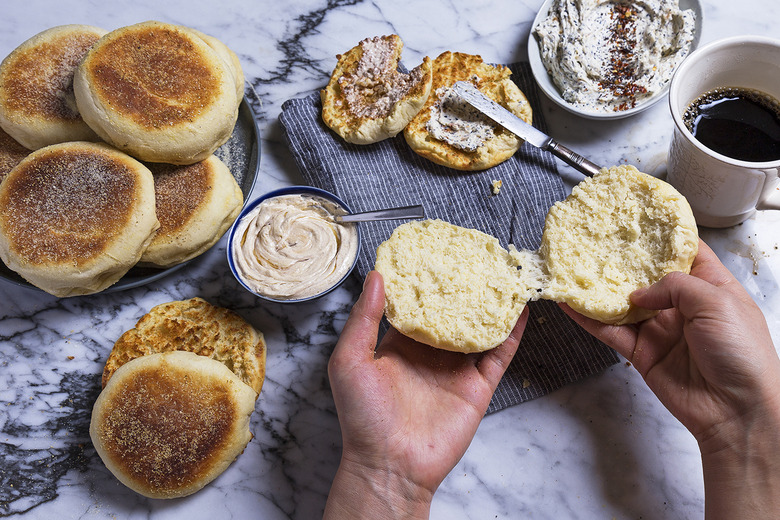
Locate an element on the screen. The image size is (780, 520). spoon is located at coordinates (373, 215).